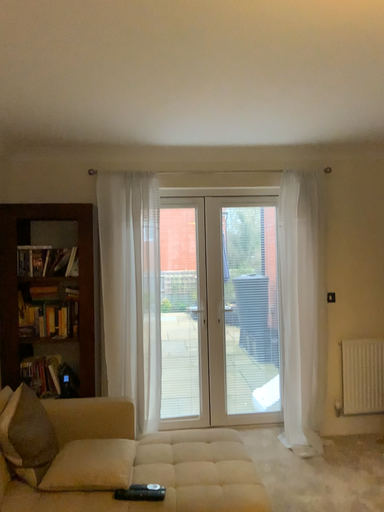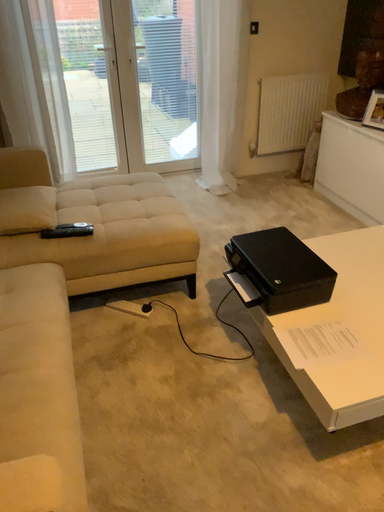
Question: Which way did the camera rotate in the video?

Choices:
 (A) rotated right
 (B) rotated left

Answer: (A)